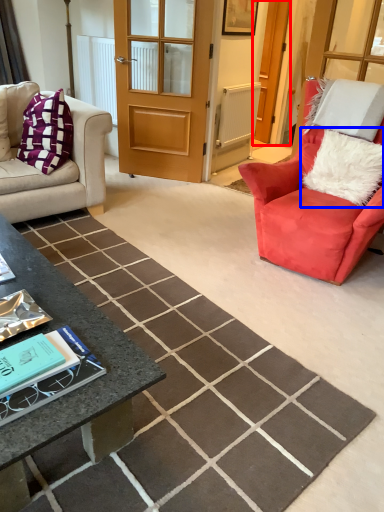
Question: Which object appears farthest to the camera in this image, screen door (highlighted by a red box) or pillow (highlighted by a blue box)?

Choices:
 (A) screen door
 (B) pillow

Answer: (A)